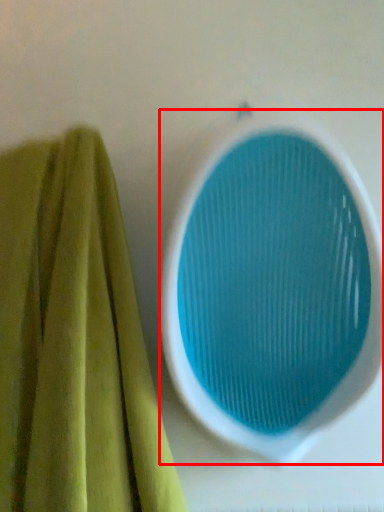
Question: From the image's perspective, where is oval (annotated by the red box) located relative to towel?

Choices:
 (A) above
 (B) below

Answer: (A)